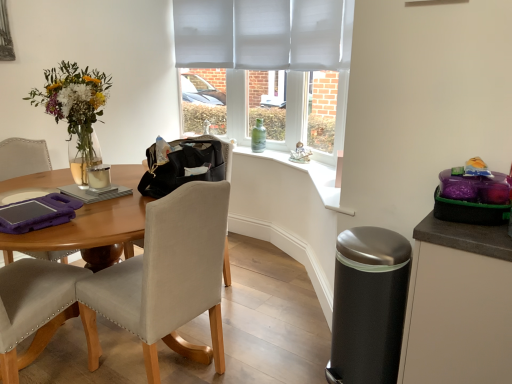
Question: Should I look upward or downward to see beige fabric chair at left?

Choices:
 (A) down
 (B) up

Answer: (A)

Question: Does matte black cabinet at right lie behind beige fabric chair at left?

Choices:
 (A) yes
 (B) no

Answer: (B)

Question: Does matte black cabinet at right have a greater width compared to beige fabric chair at left?

Choices:
 (A) yes
 (B) no

Answer: (B)

Question: From a real-world perspective, does matte black cabinet at right sit lower than beige fabric chair at left?

Choices:
 (A) no
 (B) yes

Answer: (B)

Question: From a real-world perspective, does matte black cabinet at right stand above beige fabric chair at left?

Choices:
 (A) no
 (B) yes

Answer: (A)

Question: Can you confirm if matte black cabinet at right is smaller than beige fabric chair at left?

Choices:
 (A) yes
 (B) no

Answer: (A)

Question: Can we say matte black cabinet at right lies outside beige fabric chair at left?

Choices:
 (A) yes
 (B) no

Answer: (A)

Question: From the image's perspective, is green glass bottle at window under matte white mug at table?

Choices:
 (A) yes
 (B) no

Answer: (B)

Question: Does green glass bottle at window have a lesser width compared to matte white mug at table?

Choices:
 (A) no
 (B) yes

Answer: (A)

Question: From a real-world perspective, is green glass bottle at window over matte white mug at table?

Choices:
 (A) yes
 (B) no

Answer: (B)

Question: Are green glass bottle at window and matte white mug at table making contact?

Choices:
 (A) no
 (B) yes

Answer: (A)

Question: Considering the relative positions of green glass bottle at window and matte white mug at table in the image provided, is green glass bottle at window to the right of matte white mug at table from the viewer's perspective?

Choices:
 (A) no
 (B) yes

Answer: (B)

Question: Does green glass bottle at window have a greater width compared to matte white mug at table?

Choices:
 (A) yes
 (B) no

Answer: (A)

Question: Is satin black trash can at lower right located within matte black cabinet at right?

Choices:
 (A) no
 (B) yes

Answer: (A)